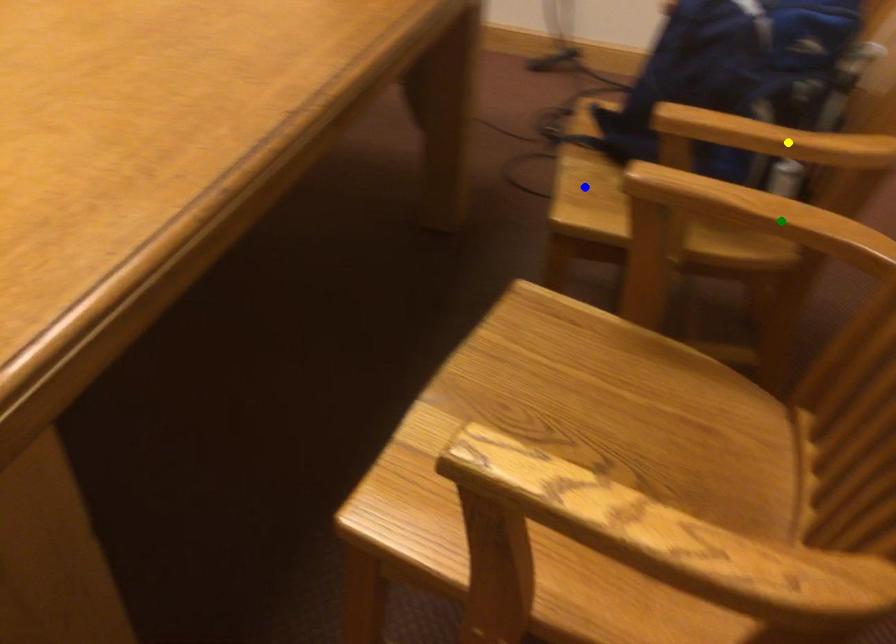
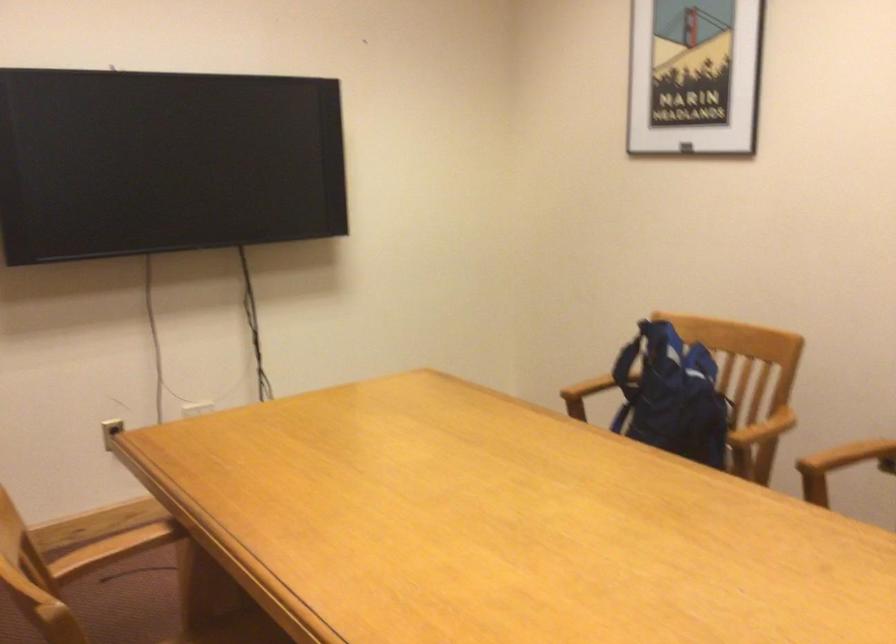
I am providing you with two images of the same scene from different viewpoints. Three points are marked in image1. Which point corresponds to a part or object that is occluded in image2?In image1, three points are marked. Which of them correspond to a part or object that is occluded in image2?Among the three points shown in image1, which one corresponds to a part or object that is no longer visible due to occlusion in image2?

blue point